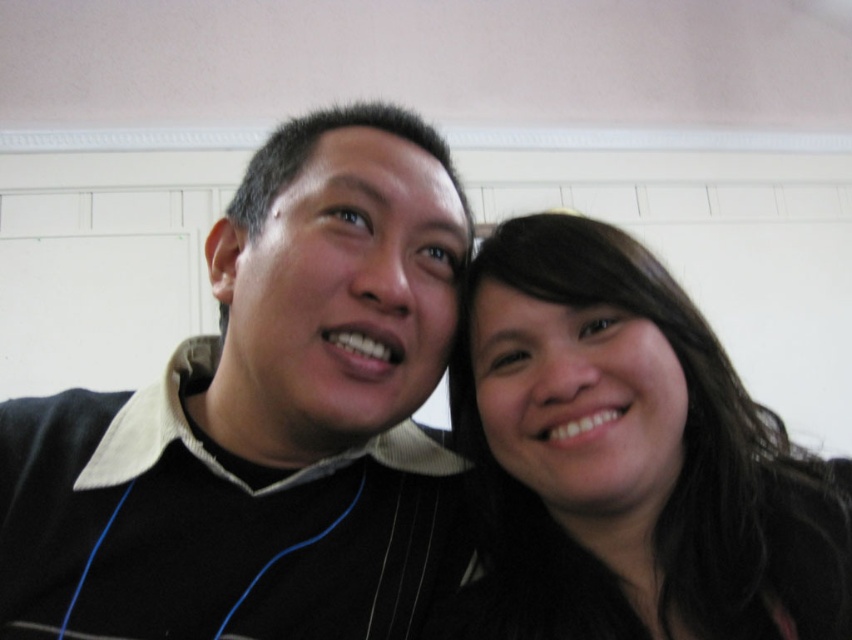
Question: Does black matte sweater at center have a smaller size compared to dark brown hair at center?

Choices:
 (A) no
 (B) yes

Answer: (A)

Question: Among these objects, which one is farthest from the camera?

Choices:
 (A) black matte sweater at center
 (B) dark brown hair at center

Answer: (B)

Question: In this image, where is black matte sweater at center located relative to dark brown hair at center?

Choices:
 (A) above
 (B) below

Answer: (A)

Question: Is black matte sweater at center above dark brown hair at center?

Choices:
 (A) no
 (B) yes

Answer: (B)